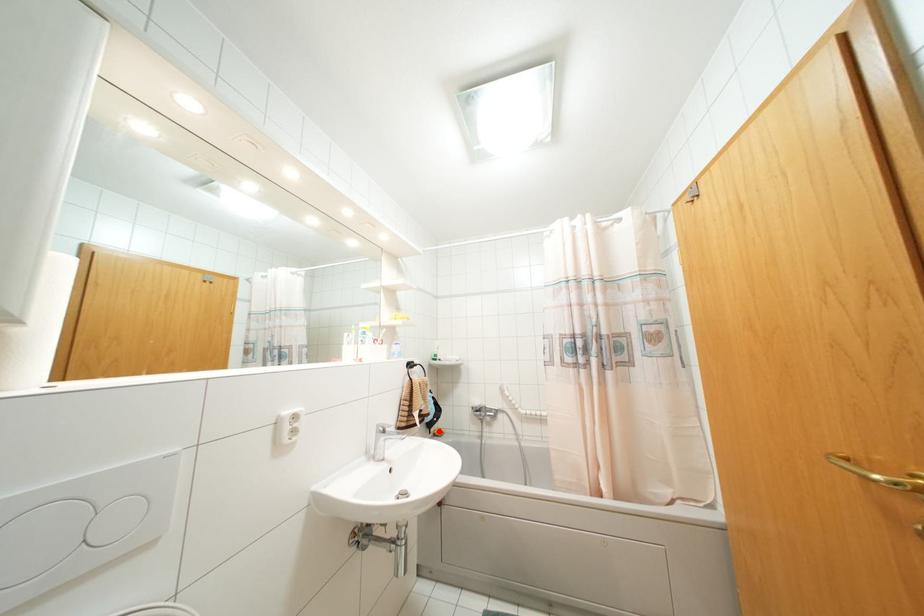
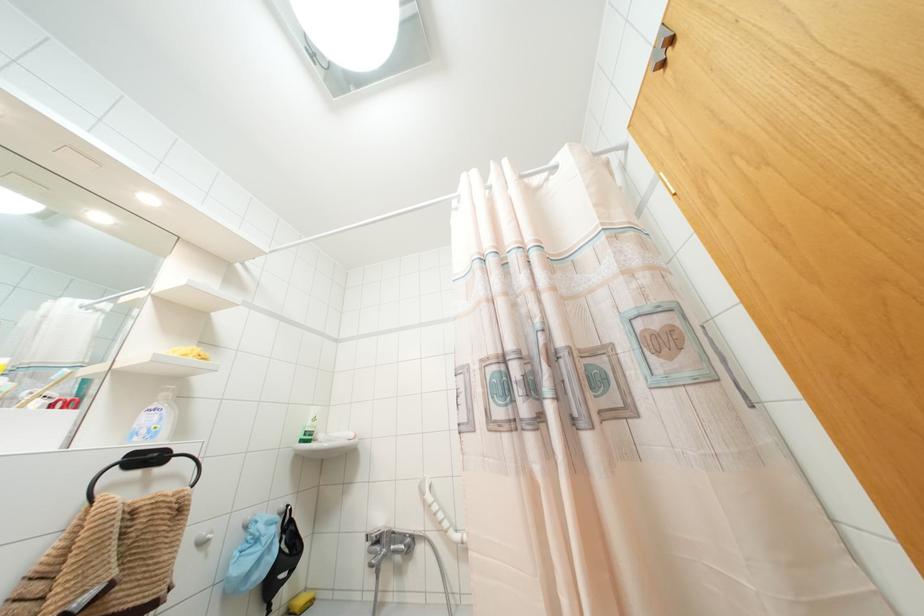
Question: I am providing you with two images of the same scene from different viewpoints. Given a red point in image1, look at the same physical point in image2. Is it:

Choices:
 (A) Closer to the viewpoint
 (B) Farther from the viewpoint

Answer: (A)